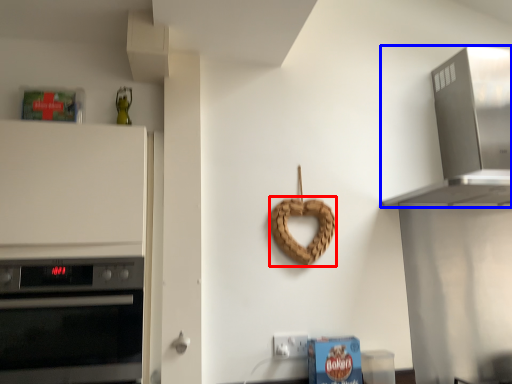
Question: Which object appears farthest to the camera in this image, pretzel (highlighted by a red box) or home appliance (highlighted by a blue box)?

Choices:
 (A) pretzel
 (B) home appliance

Answer: (A)